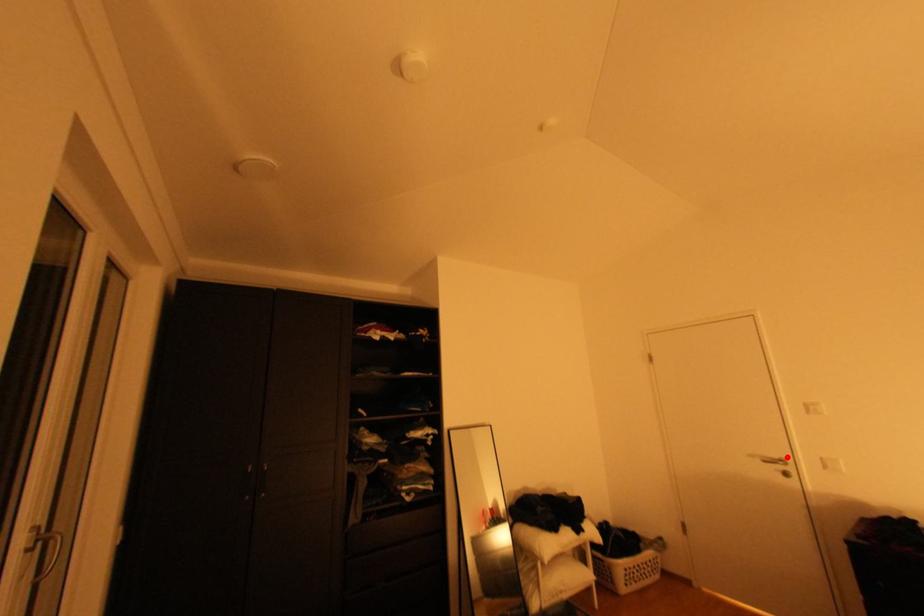
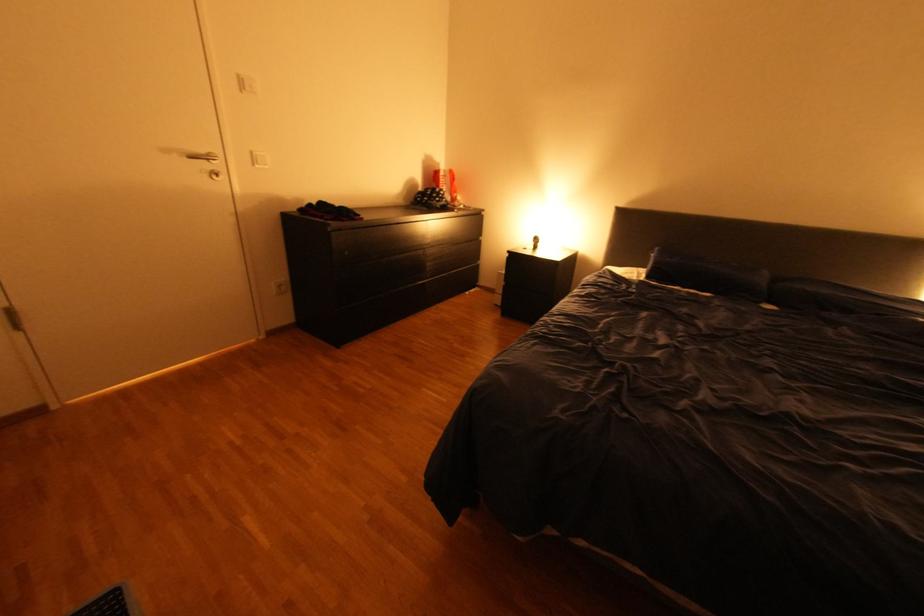
The point at the highlighted location is marked in the first image. Where is the corresponding point in the second image?

(213, 151)